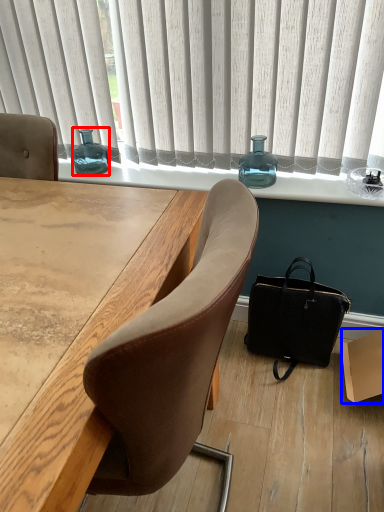
Question: Which of the following is the closest to the observer, bottle (highlighted by a red box) or box (highlighted by a blue box)?

Choices:
 (A) bottle
 (B) box

Answer: (B)